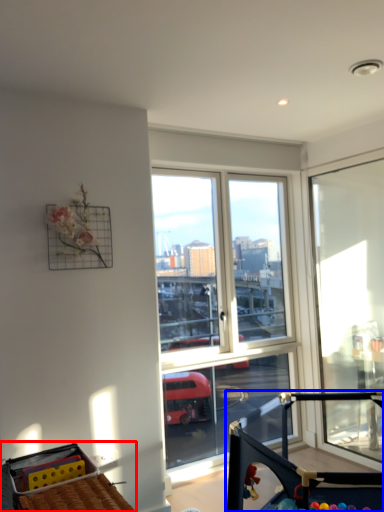
Question: Which of the following is the closest to the observer, baby carriage (highlighted by a red box) or baby carriage (highlighted by a blue box)?

Choices:
 (A) baby carriage
 (B) baby carriage

Answer: (B)